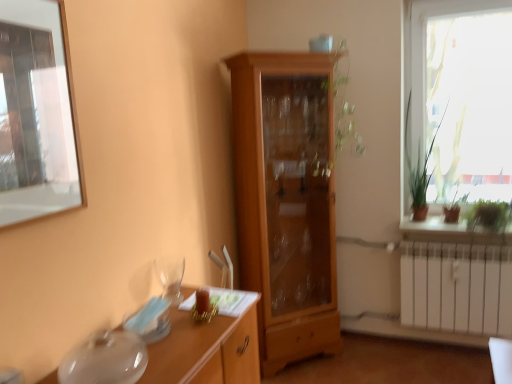
Question: Visually, is clear glass wine glass at lower left positioned to the left or to the right of green leafy plant at right, the second plant from the left?

Choices:
 (A) right
 (B) left

Answer: (B)

Question: From the image's perspective, relative to green leafy plant at right, the first plant from the right, is clear glass wine glass at lower left above or below?

Choices:
 (A) below
 (B) above

Answer: (A)

Question: Which object is positioned closest to the transparent glass desk at lower left?

Choices:
 (A) transparent glass window screen at upper left
 (B) clear glass wine glass at lower left
 (C) green leafy plant at right, the second plant from the left
 (D) light brown wood cabinet at center
 (E) transparent glass window at right

Answer: (B)

Question: Which is farther from the clear glass wine glass at lower left?

Choices:
 (A) transparent glass desk at lower left
 (B) green leafy plant at right, which is counted as the first plant, starting from the left
 (C) green leafy plant at right, the second plant from the left
 (D) light brown wood cabinet at center
 (E) green matte plant at right

Answer: (C)